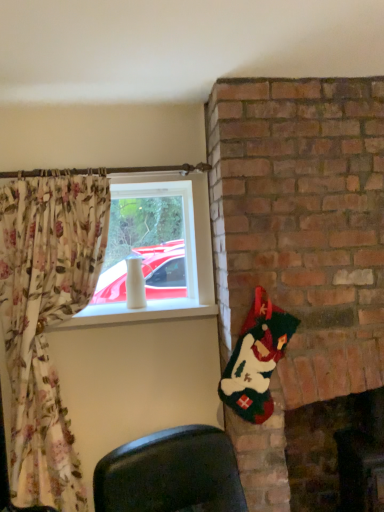
Question: Does white glossy vase at upper left contain brick fireplace at lower right?

Choices:
 (A) no
 (B) yes

Answer: (A)

Question: Is white glossy vase at upper left far from brick fireplace at lower right?

Choices:
 (A) no
 (B) yes

Answer: (B)

Question: From the image's perspective, is white glossy vase at upper left above brick fireplace at lower right?

Choices:
 (A) yes
 (B) no

Answer: (A)

Question: Could you tell me if white glossy vase at upper left is facing brick fireplace at lower right?

Choices:
 (A) yes
 (B) no

Answer: (B)

Question: Considering the relative sizes of white glossy vase at upper left and brick fireplace at lower right in the image provided, is white glossy vase at upper left wider than brick fireplace at lower right?

Choices:
 (A) no
 (B) yes

Answer: (A)

Question: From a real-world perspective, does white glossy vase at upper left stand above brick fireplace at lower right?

Choices:
 (A) yes
 (B) no

Answer: (A)

Question: Would you say white glossy vase at upper left is part of brick fireplace at lower right's contents?

Choices:
 (A) yes
 (B) no

Answer: (B)

Question: Can we say brick fireplace at lower right lies outside white glossy vase at upper left?

Choices:
 (A) no
 (B) yes

Answer: (B)

Question: From a real-world perspective, is brick fireplace at lower right physically below white glossy vase at upper left?

Choices:
 (A) no
 (B) yes

Answer: (B)

Question: From a real-world perspective, is brick fireplace at lower right on white glossy vase at upper left?

Choices:
 (A) yes
 (B) no

Answer: (B)

Question: Is brick fireplace at lower right at the left side of white glossy vase at upper left?

Choices:
 (A) no
 (B) yes

Answer: (A)

Question: Would you say brick fireplace at lower right is a long distance from white glossy vase at upper left?

Choices:
 (A) no
 (B) yes

Answer: (B)

Question: In terms of height, does white glossy vase at upper left look taller or shorter compared to brick fireplace at lower right?

Choices:
 (A) tall
 (B) short

Answer: (B)